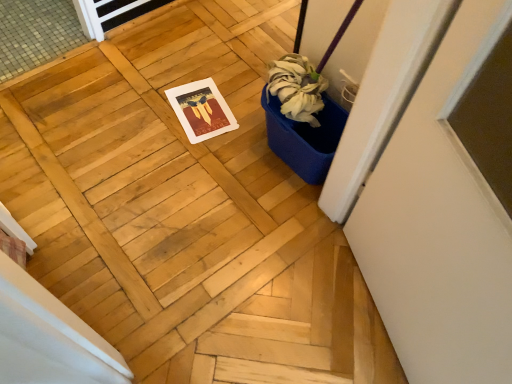
Based on the photo, measure the distance between point (x=508, y=15) and camera.

Point (x=508, y=15) and camera are 24.76 inches apart from each other.

Measure the distance between white matte screen door at right and camera.

The distance of white matte screen door at right from camera is 24.54 inches.

This screenshot has height=384, width=512. Describe the element at coordinates (440, 225) in the screenshot. I see `white matte screen door at right` at that location.

Image resolution: width=512 pixels, height=384 pixels. I want to click on white matte screen door at right, so click(x=440, y=225).

Find the location of a particular element. white matte screen door at right is located at coordinates (440, 225).